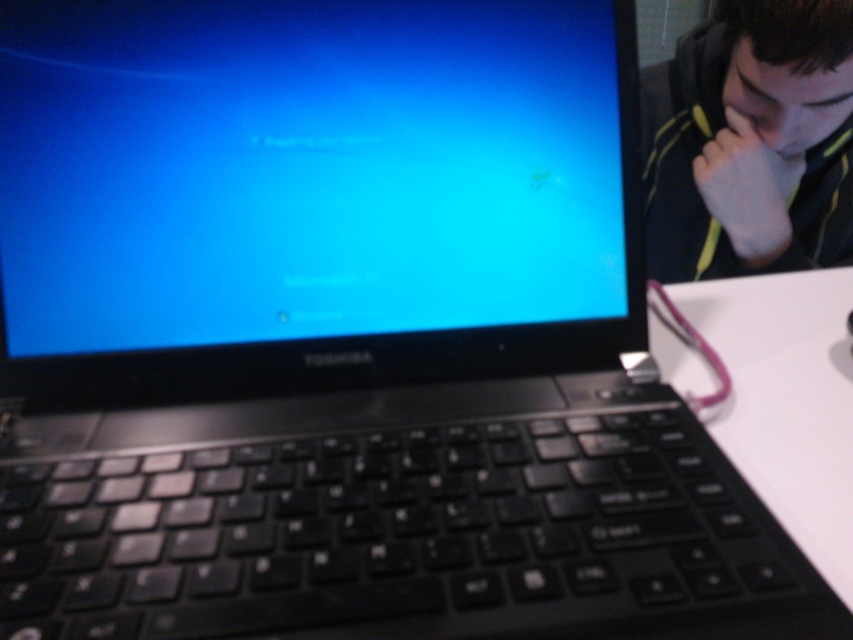
Does black fleece jacket at upper right come behind white matte table at lower right?

Yes, black fleece jacket at upper right is behind white matte table at lower right.

Does black fleece jacket at upper right have a greater height compared to white matte table at lower right?

Yes.

Identify the location of black fleece jacket at upper right. (750, 141).

What do you see at coordinates (314, 172) in the screenshot? Image resolution: width=853 pixels, height=640 pixels. I see `blue glossy screen at center` at bounding box center [314, 172].

The image size is (853, 640). I want to click on blue glossy screen at center, so click(x=314, y=172).

At what (x,y) coordinates should I click in order to perform the action: click on blue glossy screen at center. Please return your answer as a coordinate pair (x, y). Looking at the image, I should click on (314, 172).

Between point (469, 349) and point (657, 227), which one is positioned behind?

The point (657, 227) is more distant.

Can you confirm if blue glossy screen at center is smaller than black fleece jacket at upper right?

Yes, blue glossy screen at center is smaller than black fleece jacket at upper right.

Who is more distant from viewer, (637, 285) or (650, 113)?

The point (650, 113) is more distant.

Where is `blue glossy screen at center`? Image resolution: width=853 pixels, height=640 pixels. blue glossy screen at center is located at coordinates (314, 172).